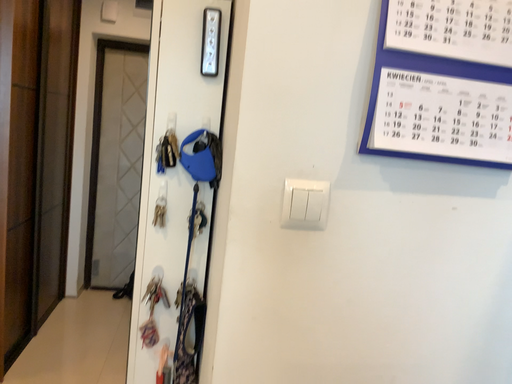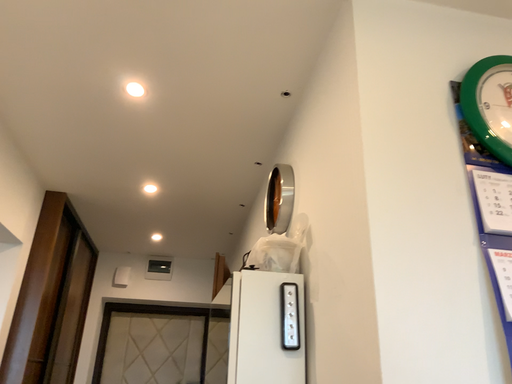
Question: How did the camera likely rotate when shooting the video?

Choices:
 (A) rotated downward
 (B) rotated upward

Answer: (B)